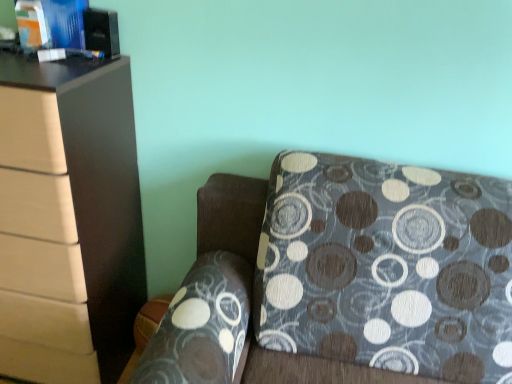
Question: Is matte brown chest of drawers at left thinner than matte blue book at upper left, which appears as the 1th book when viewed from the left?

Choices:
 (A) no
 (B) yes

Answer: (A)

Question: Does matte brown chest of drawers at left have a larger size compared to matte blue book at upper left, which is counted as the 2th book, starting from the right?

Choices:
 (A) no
 (B) yes

Answer: (B)

Question: Is matte brown chest of drawers at left taller than matte blue book at upper left, which appears as the 1th book when viewed from the left?

Choices:
 (A) yes
 (B) no

Answer: (A)

Question: Could you tell me if matte brown chest of drawers at left is facing matte blue book at upper left, which is counted as the 2th book, starting from the right?

Choices:
 (A) no
 (B) yes

Answer: (A)

Question: From a real-world perspective, is matte brown chest of drawers at left below matte blue book at upper left, which appears as the 1th book when viewed from the left?

Choices:
 (A) yes
 (B) no

Answer: (A)

Question: From their relative heights in the image, would you say patterned fabric couch at lower right is taller or shorter than matte blue book at upper left, which appears as the 1th book when viewed from the left?

Choices:
 (A) short
 (B) tall

Answer: (B)

Question: Is point (467, 279) closer or farther from the camera than point (49, 33)?

Choices:
 (A) closer
 (B) farther

Answer: (A)

Question: From a real-world perspective, relative to matte blue book at upper left, which is counted as the 2th book, starting from the right, is patterned fabric couch at lower right vertically above or below?

Choices:
 (A) below
 (B) above

Answer: (A)

Question: From the image's perspective, is patterned fabric couch at lower right above or below matte blue book at upper left, which appears as the 1th book when viewed from the left?

Choices:
 (A) below
 (B) above

Answer: (A)

Question: Is matte brown chest of drawers at left to the left or to the right of matte blue book at upper left, which is counted as the 2th book, starting from the right, in the image?

Choices:
 (A) right
 (B) left

Answer: (B)

Question: From the image's perspective, is matte brown chest of drawers at left located above or below matte blue book at upper left, which appears as the 1th book when viewed from the left?

Choices:
 (A) below
 (B) above

Answer: (A)

Question: Is matte brown chest of drawers at left wider or thinner than matte blue book at upper left, which is counted as the 2th book, starting from the right?

Choices:
 (A) thin
 (B) wide

Answer: (B)

Question: From a real-world perspective, is matte brown chest of drawers at left physically located above or below matte blue book at upper left, which appears as the 1th book when viewed from the left?

Choices:
 (A) above
 (B) below

Answer: (B)

Question: Is point (30, 11) positioned closer to the camera than point (320, 349)?

Choices:
 (A) closer
 (B) farther

Answer: (B)

Question: From the image's perspective, is matte blue book at upper left, which is counted as the 2th book, starting from the right, above or below patterned fabric couch at lower right?

Choices:
 (A) above
 (B) below

Answer: (A)